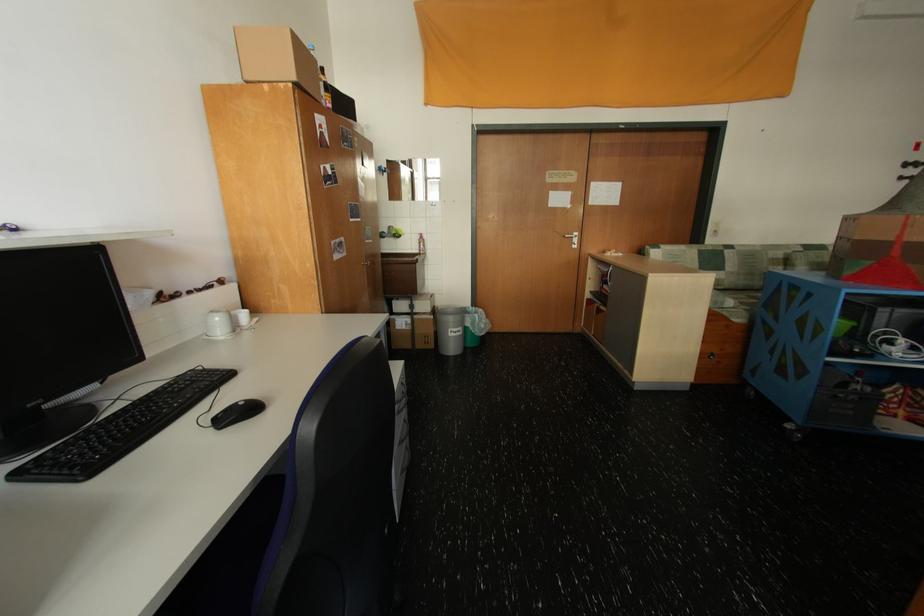
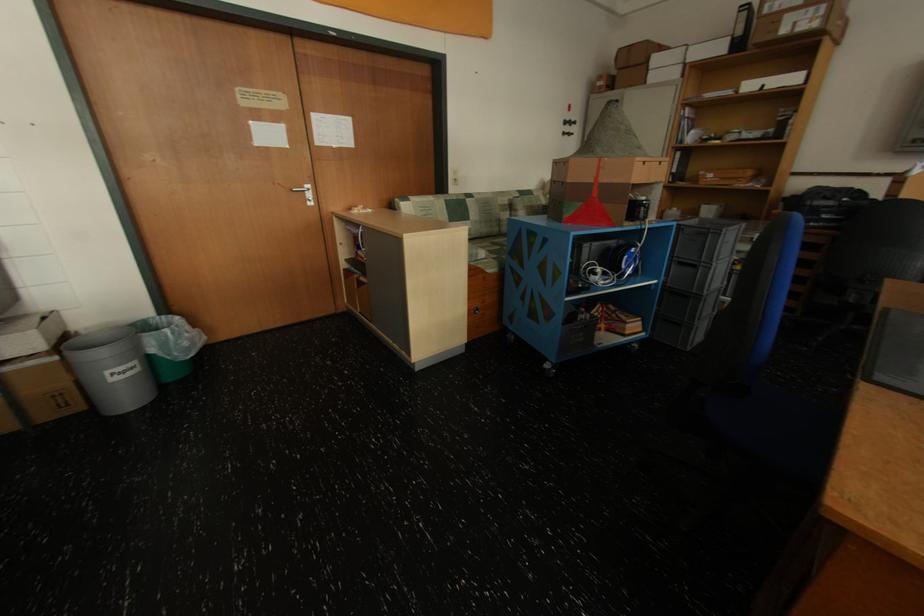
In the second image, find the point that corresponds to point 580,238 in the first image.

(312, 192)